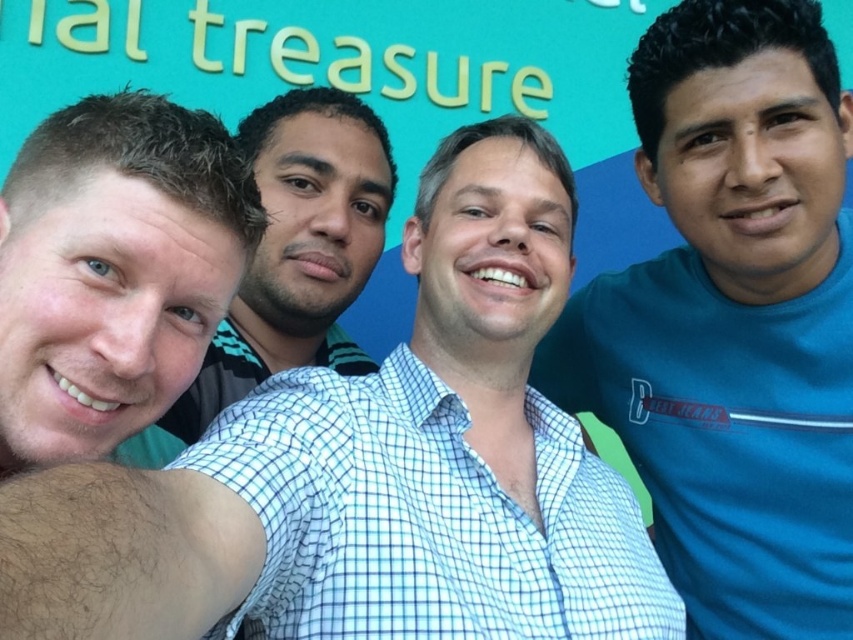
You are trying to decide which of the two people in the center of the image is closer to the camera. Both are wearing checkered shirts. The blue checkered shirt at center and the white checkered shirt at center. Which one is taller?

The blue checkered shirt at center is much taller than the white checkered shirt at center.

You are a photographer trying to capture a group photo of the blue cotton shirt at center and the white checkered shirt at center. The camera you are using has a maximum focus range of 2 meters. Will both subjects be in focus?

The blue cotton shirt at center and the white checkered shirt at center are 1.97 meters apart from each other, so yes, both subjects will be in focus since the distance between them is within the camera maximum focus range of 2 meters.

You are taking a photo of two people wearing shirts. The blue checkered shirt at center and the blue cotton shirt at center. Which shirt is closer to the camera?

The blue checkered shirt at center is in front of the blue cotton shirt at center, so the blue checkered shirt at center is closer to the camera.